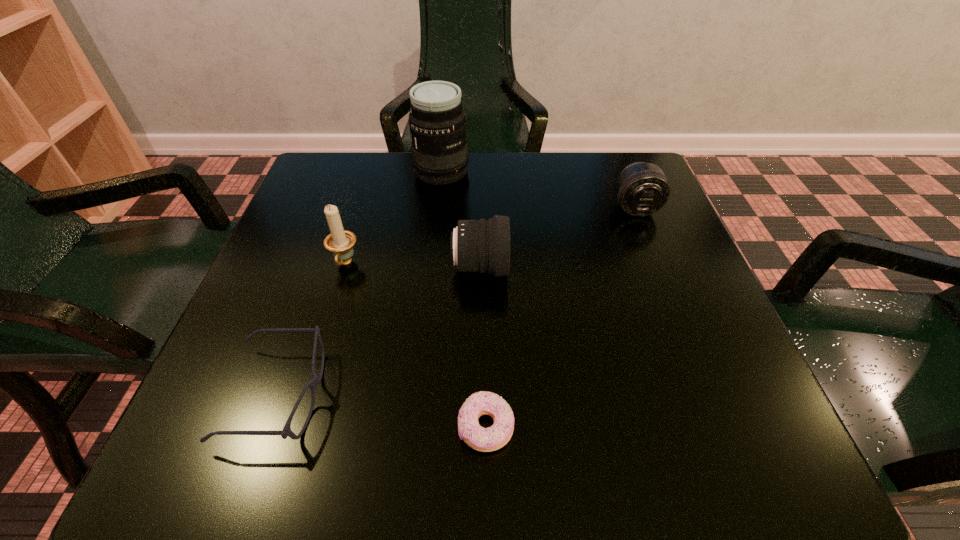
Locate an element on the screen. The image size is (960, 540). vacant space that is in between the nearest telephoto lens and the doughnut is located at coordinates (483, 348).

Identify the location of vacant region between the spectacles and the nearest telephoto lens. (379, 331).

Where is `unoccupied area between the tallest object and the fifth tallest object`? This screenshot has width=960, height=540. unoccupied area between the tallest object and the fifth tallest object is located at coordinates (360, 283).

Where is `vacant space that is in between the fifth shortest object and the tallest telephoto lens`? The height and width of the screenshot is (540, 960). vacant space that is in between the fifth shortest object and the tallest telephoto lens is located at coordinates (394, 218).

This screenshot has width=960, height=540. I want to click on empty space that is in between the doughnut and the nearest telephoto lens, so click(483, 348).

The image size is (960, 540). What are the coordinates of `vacant space in between the doughnut and the nearest telephoto lens` in the screenshot? It's located at (483, 348).

This screenshot has width=960, height=540. What are the coordinates of `free spot between the second tallest object and the nearest telephoto lens` in the screenshot? It's located at (413, 266).

At what (x,y) coordinates should I click in order to perform the action: click on object that is the second nearest to the shortest object. Please return your answer as a coordinate pair (x, y). This screenshot has height=540, width=960. Looking at the image, I should click on (481, 245).

Find the location of `object that is the second closest to the spectacles`. object that is the second closest to the spectacles is located at coordinates (482, 439).

Choose which telephoto lens is the second nearest neighbor to the second farthest telephoto lens. Please provide its 2D coordinates. Your answer should be formatted as a tuple, i.e. [(x, y)], where the tuple contains the x and y coordinates of a point satisfying the conditions above.

[(437, 123)]